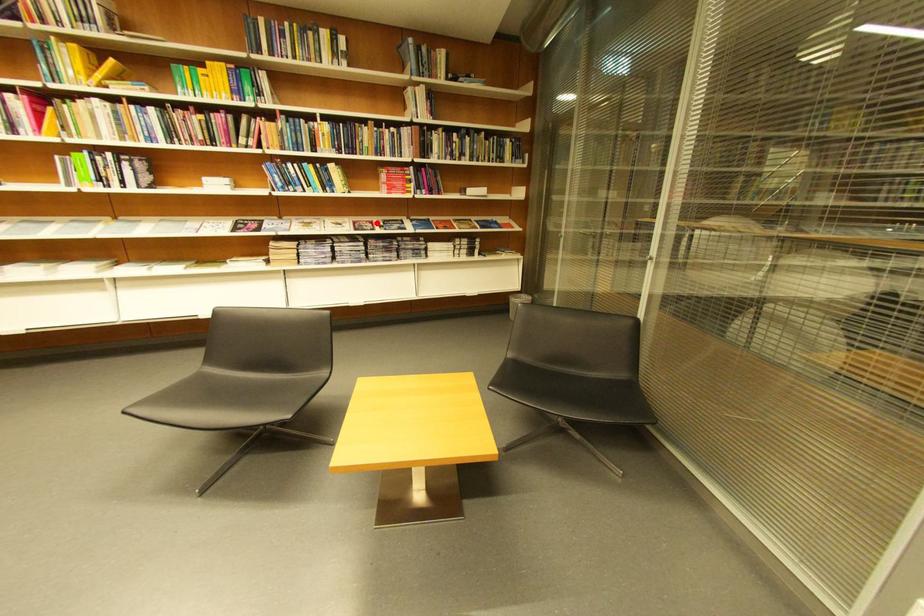
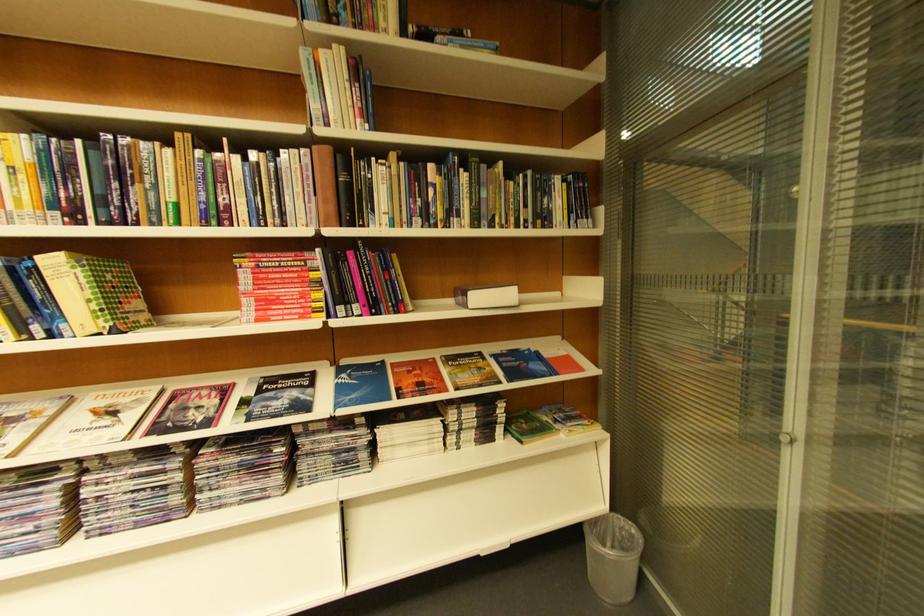
The point at the highlighted location is marked in the first image. Where is the corresponding point in the second image?

(224, 389)